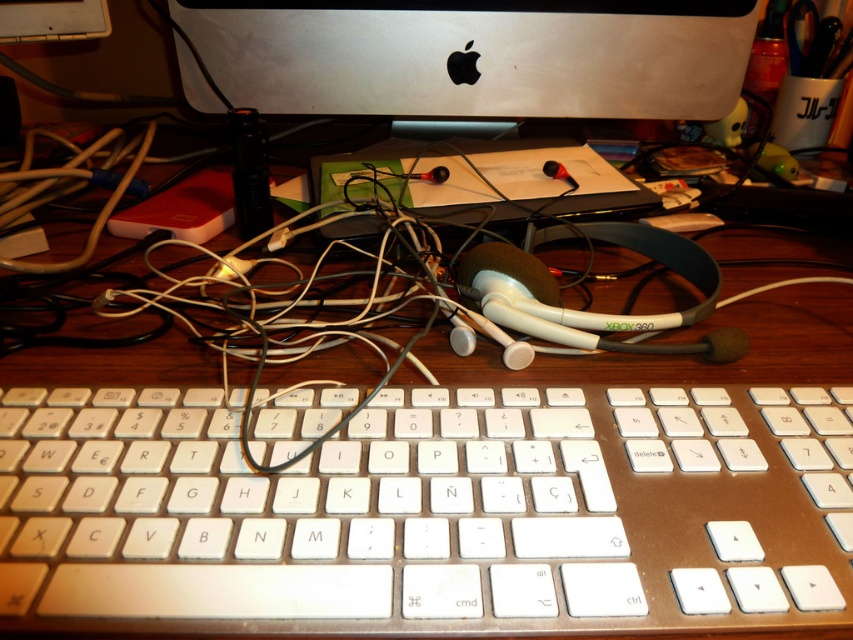
Measure the distance between white plastic keyboard at center and camera.

The distance of white plastic keyboard at center from camera is 10.39 inches.

Between point (358, 438) and point (316, 24), which one is positioned behind?

Positioned behind is point (316, 24).

Does point (340, 512) lie in front of point (329, 92)?

Yes, it is.

Locate an element on the screen. Image resolution: width=853 pixels, height=640 pixels. white plastic keyboard at center is located at coordinates (430, 513).